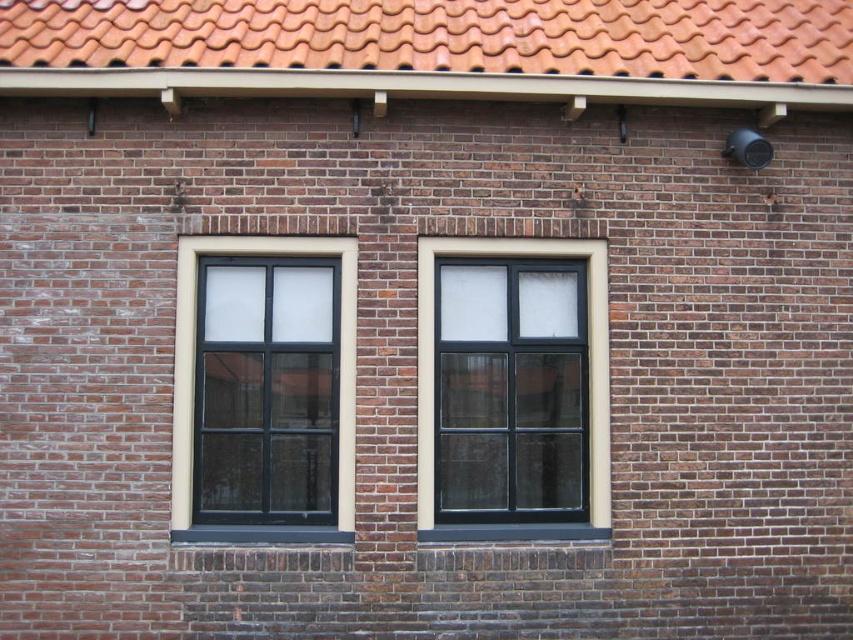
Question: Is terracotta clay tiles at top in front of black glass window at center?

Choices:
 (A) no
 (B) yes

Answer: (B)

Question: Is the position of terracotta clay tiles at top less distant than that of black matte window at left?

Choices:
 (A) yes
 (B) no

Answer: (A)

Question: Which object is positioned farthest from the terracotta clay tiles at top?

Choices:
 (A) black glass window at center
 (B) black matte window at left

Answer: (B)

Question: Which of the following is the farthest from the observer?

Choices:
 (A) (590, 483)
 (B) (119, 12)

Answer: (B)

Question: Among these points, which one is farthest from the camera?

Choices:
 (A) (180, 257)
 (B) (595, 401)
 (C) (718, 45)

Answer: (C)

Question: Can you confirm if terracotta clay tiles at top is positioned to the left of black matte window at left?

Choices:
 (A) yes
 (B) no

Answer: (B)